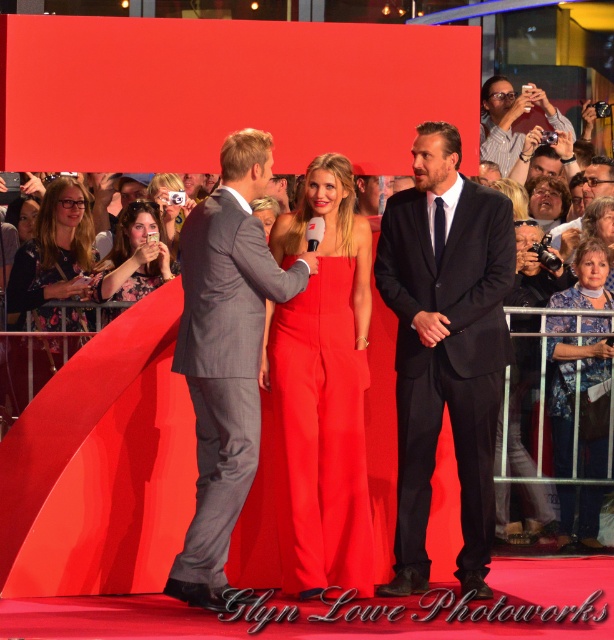
Is matte red jumpsuit at center in front of matte black camera at upper right?

Yes, matte red jumpsuit at center is in front of matte black camera at upper right.

Is matte red jumpsuit at center taller than matte black camera at upper right?

Correct, matte red jumpsuit at center is much taller as matte black camera at upper right.

Who is more distant from viewer, (x=368, y=269) or (x=492, y=90)?

Positioned behind is point (x=492, y=90).

Locate an element on the screen. matte red jumpsuit at center is located at coordinates (321, 390).

Can you confirm if matte black suit at center is positioned to the left of matte black camera at upper right?

Indeed, matte black suit at center is positioned on the left side of matte black camera at upper right.

Who is more forward, (464,528) or (502,147)?

Point (464,528) is more forward.

At what (x,y) coordinates should I click in order to perform the action: click on matte black suit at center. Please return your answer as a coordinate pair (x, y). Image resolution: width=614 pixels, height=640 pixels. Looking at the image, I should click on (445, 348).

Between blue floral dress at center and floral-patterned dress at lower left, which one appears on the left side from the viewer's perspective?

From the viewer's perspective, floral-patterned dress at lower left appears more on the left side.

The height and width of the screenshot is (640, 614). What do you see at coordinates (572, 388) in the screenshot?
I see `blue floral dress at center` at bounding box center [572, 388].

The image size is (614, 640). I want to click on blue floral dress at center, so click(572, 388).